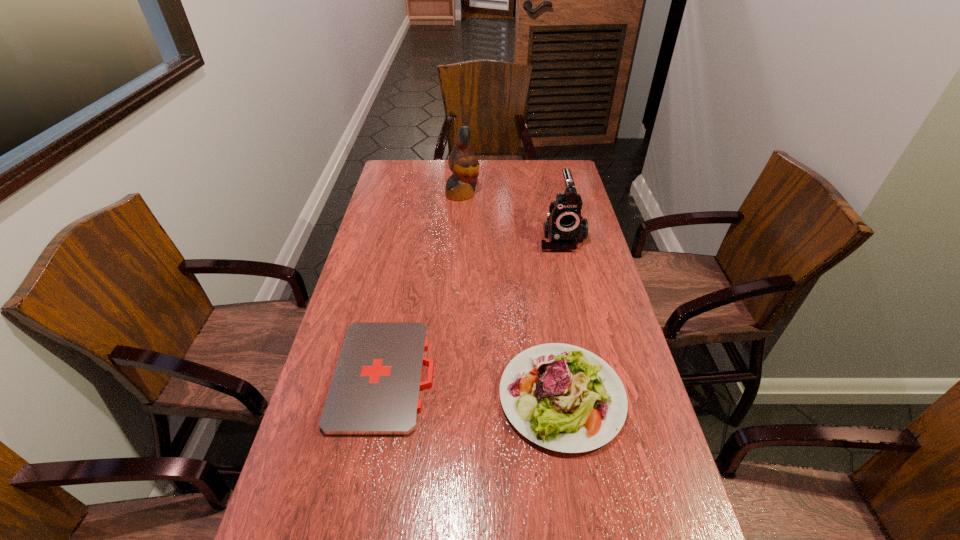
You are a GUI agent. You are given a task and a screenshot of the screen. Output one action in this format:
    pyautogui.click(x=<x>, y=<y>)
    Task: Click on the vacant space that satisfies the following two spatial constraints: 1. on the face of the parrot; 2. on the right side of the third tallest object
    The height and width of the screenshot is (540, 960).
    Given the screenshot: What is the action you would take?
    pyautogui.click(x=451, y=396)

Where is `free location that satisfies the following two spatial constraints: 1. on the face of the tallest object; 2. on the right side of the second shortest object`? Image resolution: width=960 pixels, height=540 pixels. free location that satisfies the following two spatial constraints: 1. on the face of the tallest object; 2. on the right side of the second shortest object is located at coordinates (451, 396).

Locate an element on the screen. Image resolution: width=960 pixels, height=540 pixels. vacant area in the image that satisfies the following two spatial constraints: 1. on the face of the farthest object; 2. on the left side of the salad plate is located at coordinates (451, 396).

Locate an element on the screen. This screenshot has height=540, width=960. vacant space that satisfies the following two spatial constraints: 1. on handle side the shortest object; 2. on the right side of the salad plate is located at coordinates (381, 396).

What are the coordinates of `vacant region that satisfies the following two spatial constraints: 1. on the face of the farthest object; 2. on the right side of the third tallest object` in the screenshot? It's located at (451, 396).

Find the location of a particular element. The height and width of the screenshot is (540, 960). free space that satisfies the following two spatial constraints: 1. on the lens mount of the third shortest object; 2. on handle side the shortest object is located at coordinates (592, 375).

This screenshot has height=540, width=960. I want to click on vacant region that satisfies the following two spatial constraints: 1. on the back side of the second shortest object; 2. on the face of the tallest object, so click(530, 194).